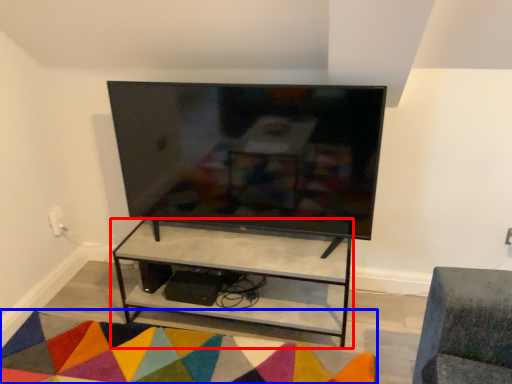
Question: Which of the following is the closest to the observer, shelf (highlighted by a red box) or mat (highlighted by a blue box)?

Choices:
 (A) shelf
 (B) mat

Answer: (B)